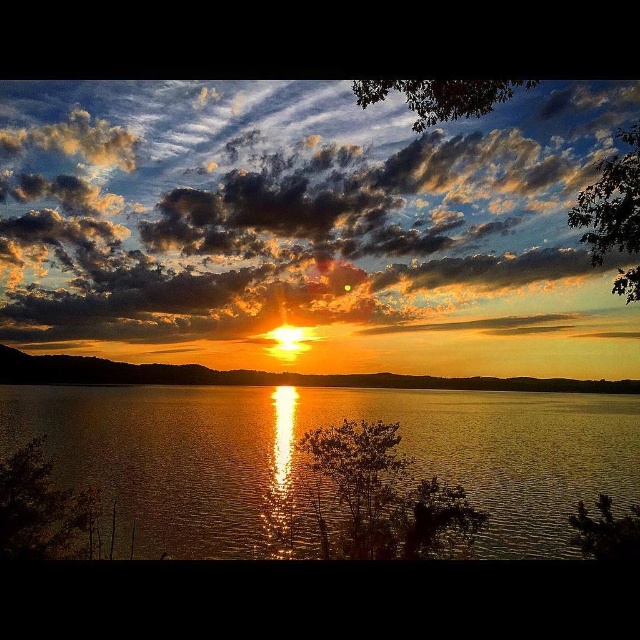
Question: Which of the following is the closest to the observer?

Choices:
 (A) cloudy sky at upper center
 (B) glistening reflective water at center

Answer: (A)

Question: Can you confirm if cloudy sky at upper center is smaller than glistening reflective water at center?

Choices:
 (A) yes
 (B) no

Answer: (B)

Question: Where is cloudy sky at upper center located in relation to glistening reflective water at center in the image?

Choices:
 (A) right
 (B) left

Answer: (B)

Question: Which of the following is the farthest from the observer?

Choices:
 (A) (500, 540)
 (B) (56, 321)

Answer: (B)

Question: Where is cloudy sky at upper center located in relation to golden matte horizon at center in the image?

Choices:
 (A) left
 (B) right

Answer: (A)

Question: Among these points, which one is nearest to the camera?

Choices:
 (A) (100, 360)
 (B) (330, 515)
 (C) (372, 189)

Answer: (B)